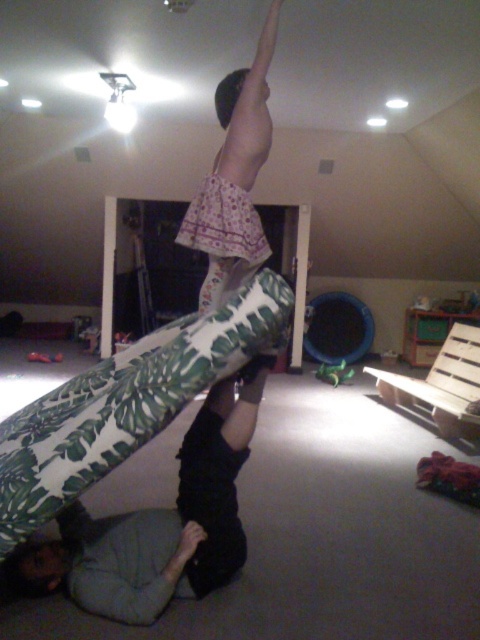
Question: Which point is farther to the camera?

Choices:
 (A) (212, 195)
 (B) (441, 413)

Answer: (B)

Question: In this image, where is pink floral skirt at upper center located relative to wooden pallet at lower right?

Choices:
 (A) above
 (B) below

Answer: (A)

Question: Is pink floral skirt at upper center to the left of wooden pallet at lower right from the viewer's perspective?

Choices:
 (A) no
 (B) yes

Answer: (B)

Question: Can you confirm if pink floral skirt at upper center is thinner than wooden pallet at lower right?

Choices:
 (A) no
 (B) yes

Answer: (B)

Question: Which object appears farthest from the camera in this image?

Choices:
 (A) pink floral skirt at upper center
 (B) wooden pallet at lower right

Answer: (B)

Question: Which point is closer to the camera taking this photo?

Choices:
 (A) (443, 348)
 (B) (252, 97)

Answer: (B)